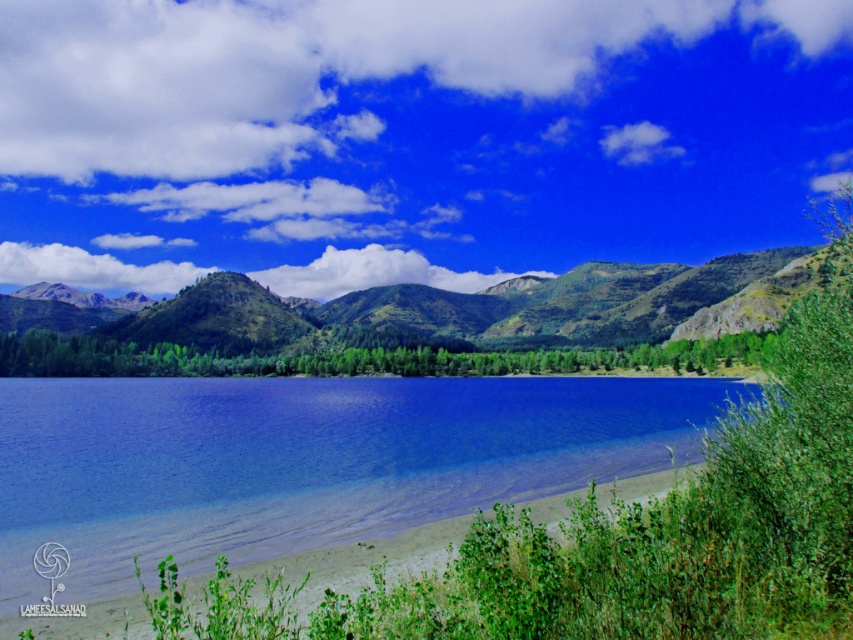
You are standing at the edge of the water in the image and want to reach the green grassy hill at center. Which direction should you head towards?

The green grassy hill at center is located at point (463, 308) in the image, so you should head towards the center of the image to reach it.

Based on the scene, can you determine if the white fluffy cloud at upper center is wider than the blue glassy water at center?

The white fluffy cloud at upper center might be wider than blue glassy water at center according to the description provided.